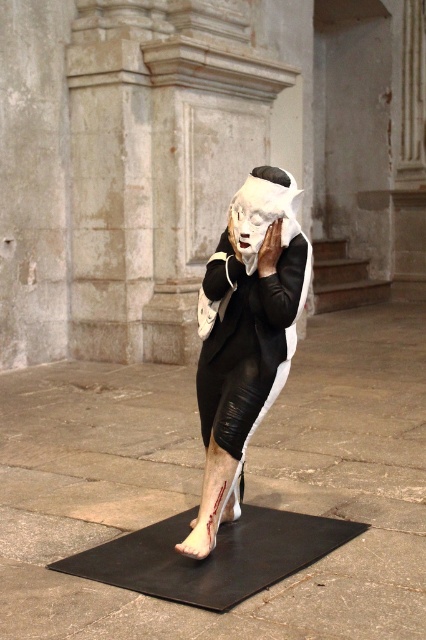
Looking at this image, measure the distance between point (245, 276) and camera.

Point (245, 276) is 11.86 feet away from camera.

Does point (233, 419) come in front of point (252, 378)?

Yes, it is in front of point (252, 378).

Between point (284, 316) and point (233, 372), which one is positioned behind?

The point (233, 372) is behind.

You are a GUI agent. You are given a task and a screenshot of the screen. Output one action in this format:
    pyautogui.click(x=<x>, y=<y>)
    Task: Click on the matte black dress at center
    
    Given the screenshot: What is the action you would take?
    pyautogui.click(x=245, y=337)

Can you confirm if black leather robe at center is positioned above white matte mask at center?

No.

Does point (230, 280) come farther from viewer compared to point (236, 248)?

Yes, it is behind point (236, 248).

Locate an element on the screen. black leather robe at center is located at coordinates (247, 342).

Is matte black dress at center further to the viewer compared to white matte mask at center?

No, matte black dress at center is in front of white matte mask at center.

At what (x,y) coordinates should I click in order to perform the action: click on matte black dress at center. Please return your answer as a coordinate pair (x, y). Looking at the image, I should click on (245, 337).

What do you see at coordinates (245, 337) in the screenshot? The height and width of the screenshot is (640, 426). I see `matte black dress at center` at bounding box center [245, 337].

Find the location of a particular element. The width and height of the screenshot is (426, 640). matte black dress at center is located at coordinates (245, 337).